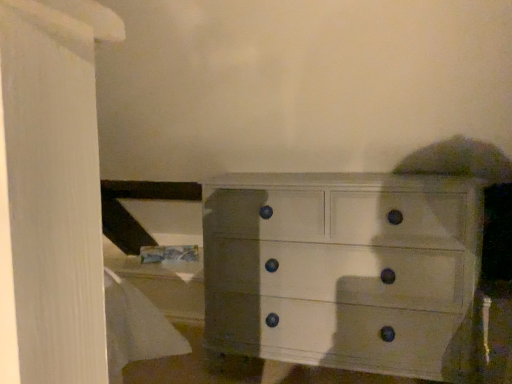
Measure the distance between white painted wood chest of drawers at center and camera.

white painted wood chest of drawers at center is 4.38 feet away from camera.

Describe the element at coordinates (344, 270) in the screenshot. I see `white painted wood chest of drawers at center` at that location.

In order to click on white painted wood chest of drawers at center in this screenshot , I will do `click(344, 270)`.

At what (x,y) coordinates should I click in order to perform the action: click on white painted wood chest of drawers at center. Please return your answer as a coordinate pair (x, y). The height and width of the screenshot is (384, 512). Looking at the image, I should click on (344, 270).